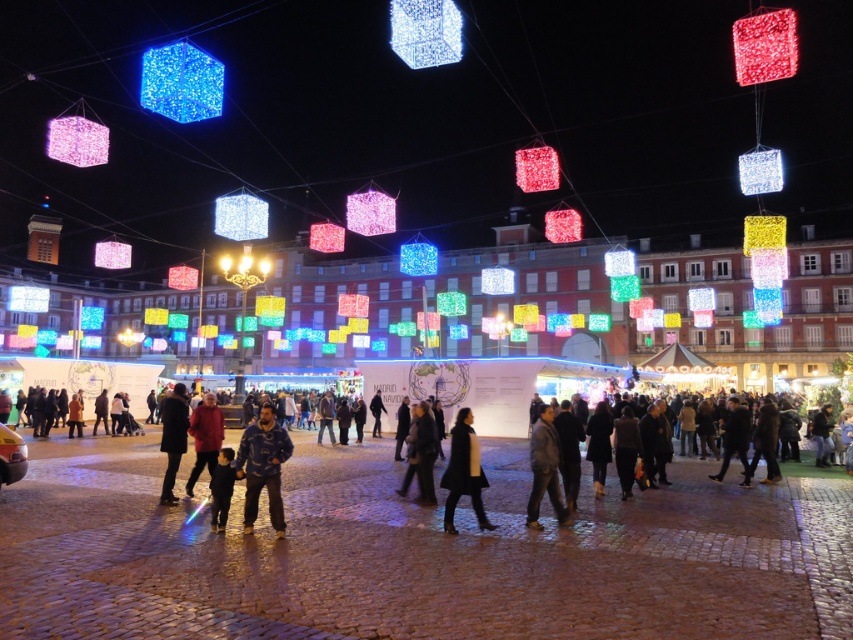
Question: Among these points, which one is farthest from the camera?

Choices:
 (A) (212, 394)
 (B) (549, 451)
 (C) (222, 468)

Answer: (A)

Question: Does dark brown leather jacket at lower left have a lesser width compared to black leather jacket at center?

Choices:
 (A) yes
 (B) no

Answer: (B)

Question: Which object is positioned closest to the leather jacket at center?

Choices:
 (A) dark blue jacket at center
 (B) dark brown leather jacket at lower left
 (C) matte blue cube at upper left
 (D) black wool coat at center

Answer: (D)

Question: Which of these objects is positioned farthest from the dark brown leather jacket at lower left?

Choices:
 (A) red matte jacket at center
 (B) black wool coat at center

Answer: (B)

Question: Can you confirm if blue fleece jacket at center is thinner than leather jacket at center?

Choices:
 (A) yes
 (B) no

Answer: (A)

Question: Can you confirm if black wool coat at center is smaller than black leather jacket at center?

Choices:
 (A) no
 (B) yes

Answer: (A)